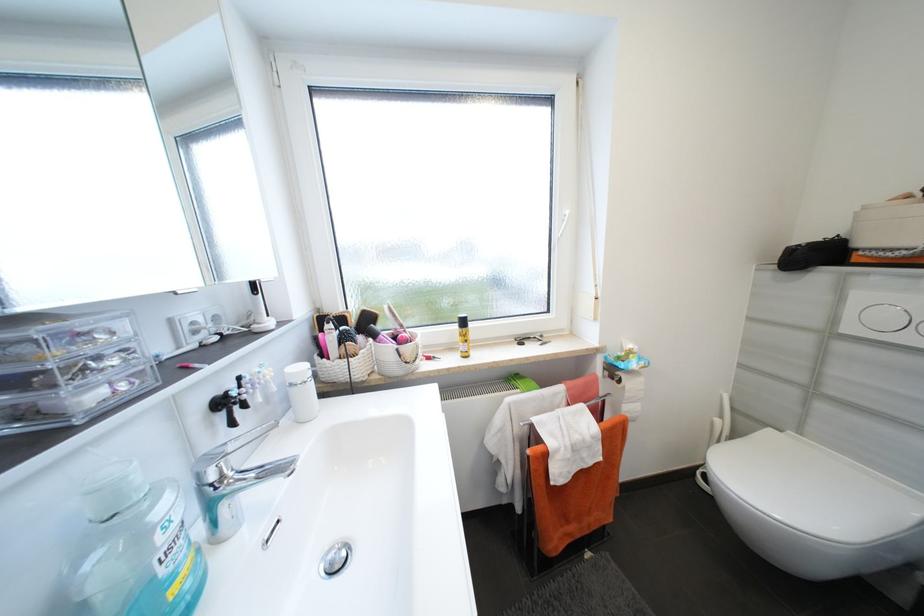
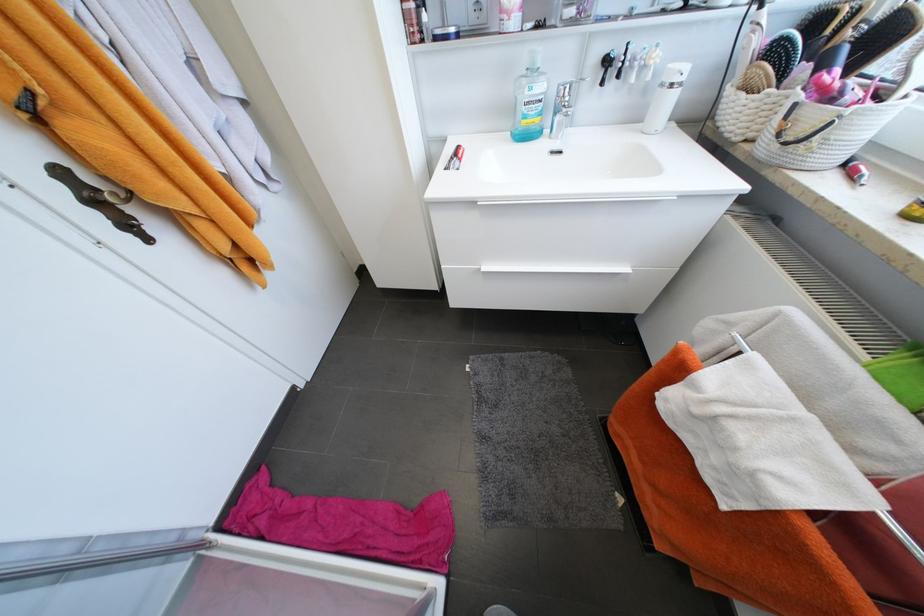
In the second image, find the point that corresponds to pixel 298 386 in the first image.

(667, 86)